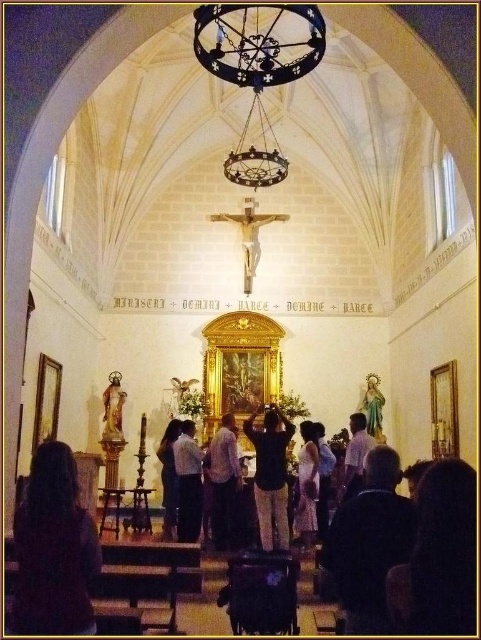
Question: Among these points, which one is nearest to the camera?

Choices:
 (A) (307, 499)
 (B) (367, 374)
 (C) (249, 420)

Answer: (A)

Question: Among these points, which one is nearest to the camera?

Choices:
 (A) (319, 448)
 (B) (374, 376)
 (C) (186, 460)

Answer: (C)

Question: Which of the following is the closest to the observer?

Choices:
 (A) (179, 476)
 (B) (227, 516)
 (C) (351, 524)

Answer: (C)

Question: Is black fabric dress at center to the left of light brown fabric dress at center from the viewer's perspective?

Choices:
 (A) no
 (B) yes

Answer: (B)

Question: Can you confirm if black matte shirt at center is positioned to the left of light brown fabric dress at center?

Choices:
 (A) yes
 (B) no

Answer: (A)

Question: Observing the image, what is the correct spatial positioning of dark brown hair at lower left in reference to light brown fabric shirt at center?

Choices:
 (A) below
 (B) above

Answer: (B)